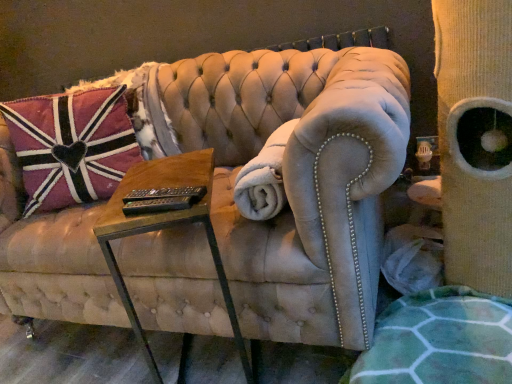
Question: Considering the positions of white plush blanket at center and suede couch at center in the image, is white plush blanket at center wider or thinner than suede couch at center?

Choices:
 (A) thin
 (B) wide

Answer: (A)

Question: From the image's perspective, is white plush blanket at center positioned above or below suede couch at center?

Choices:
 (A) below
 (B) above

Answer: (B)

Question: Estimate the real-world distances between objects in this image. Which object is closer to the woodenmaterial/texturetable at center?

Choices:
 (A) white plush blanket at center
 (B) pink velvet pillow at left
 (C) beige corduroy cat tree at right
 (D) suede couch at center

Answer: (A)

Question: Which object is positioned farthest from the pink velvet pillow at left?

Choices:
 (A) woodenmaterial/texturetable at center
 (B) beige corduroy cat tree at right
 (C) white plush blanket at center
 (D) suede couch at center

Answer: (B)